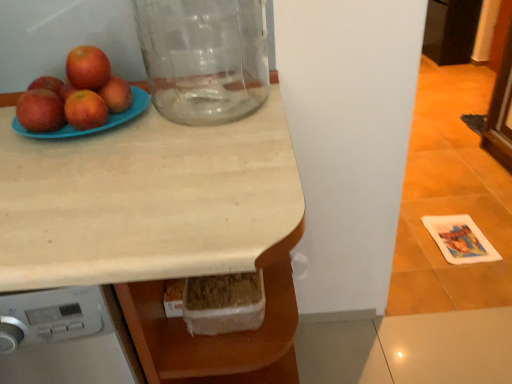
Question: Is light wood countertop at center to the left or to the right of shiny red apple at upper left, the second apple viewed from the left, in the image?

Choices:
 (A) left
 (B) right

Answer: (B)

Question: From a real-world perspective, is light wood countertop at center positioned above or below shiny red apple at upper left, the second apple viewed from the left?

Choices:
 (A) above
 (B) below

Answer: (B)

Question: Considering the real-world distances, which object is farthest from the transparent glass jar at upper left?

Choices:
 (A) matte blue plate at upper left
 (B) glossy red apple at left, which is the first apple from left to right
 (C) matte red apple at upper left, placed as the first apple when sorted from right to left
 (D) shiny red apple at left, the 2th apple from the right
 (E) light wood countertop at center

Answer: (B)

Question: Which object is the farthest from the matte blue plate at upper left?

Choices:
 (A) light wood countertop at center
 (B) shiny red apple at upper left, placed as the third apple when sorted from right to left
 (C) shiny red apple at left, the 2th apple from the right
 (D) matte red apple at upper left, which is the fourth apple from left to right
 (E) glossy red apple at left, marked as the fourth apple in a right-to-left arrangement

Answer: (A)